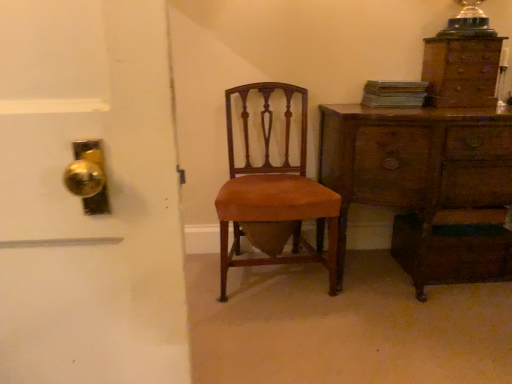
Where is `vacant space in front of wooden chest of drawers at right, the first chest of drawers positioned from the bottom`? Image resolution: width=512 pixels, height=384 pixels. vacant space in front of wooden chest of drawers at right, the first chest of drawers positioned from the bottom is located at coordinates (436, 334).